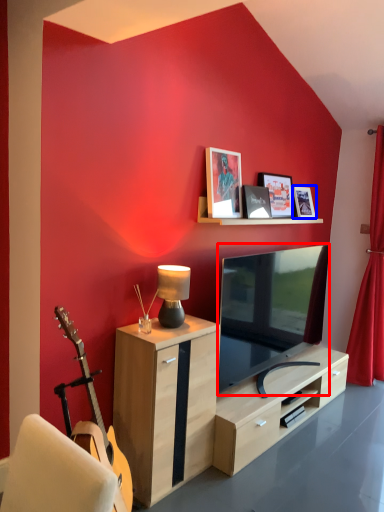
Question: Which object is further to the camera taking this photo, television (highlighted by a red box) or picture frame (highlighted by a blue box)?

Choices:
 (A) television
 (B) picture frame

Answer: (B)